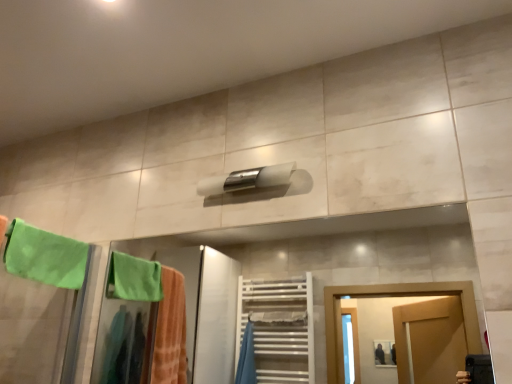
Describe the element at coordinates (45, 256) in the screenshot. The image size is (512, 384). I see `green cotton towel at left` at that location.

Identify the location of green cotton towel at left. The height and width of the screenshot is (384, 512). (45, 256).

In order to face green cotton towel at left, should I rotate leftwards or rightwards?

To align with it, rotate left about 25.355°.

Find the location of a particular element. Image resolution: width=512 pixels, height=384 pixels. green cotton towel at left is located at coordinates (45, 256).